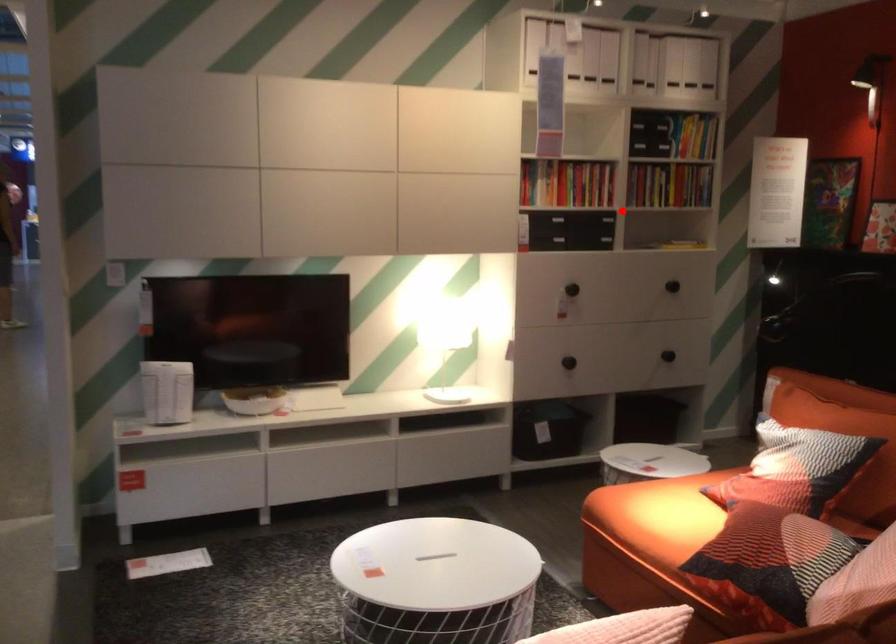
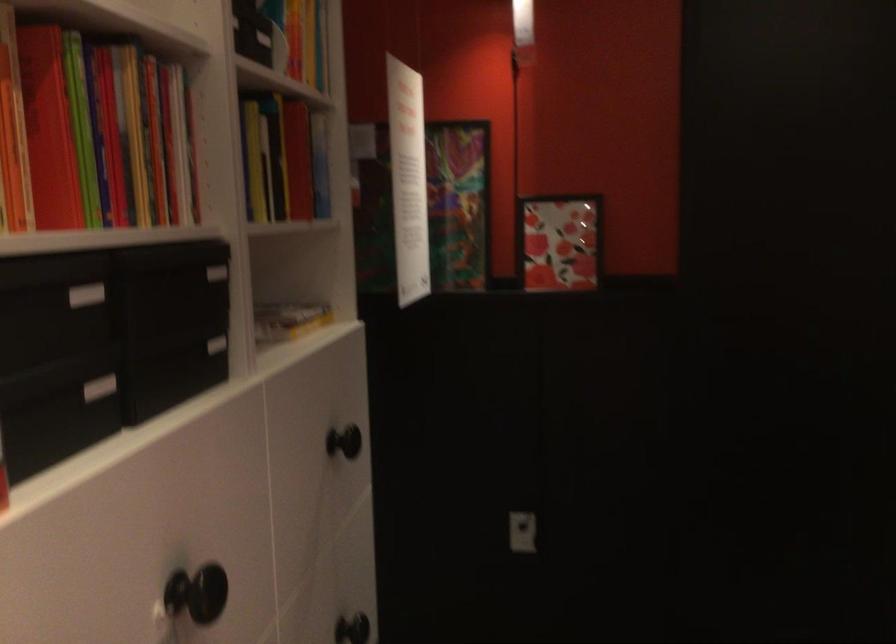
Question: I am providing you with two images of the same scene from different viewpoints. In image1, a red point is highlighted. Considering the same 3D point in image2, which of the following is correct?

Choices:
 (A) It is closer
 (B) It is farther

Answer: (A)